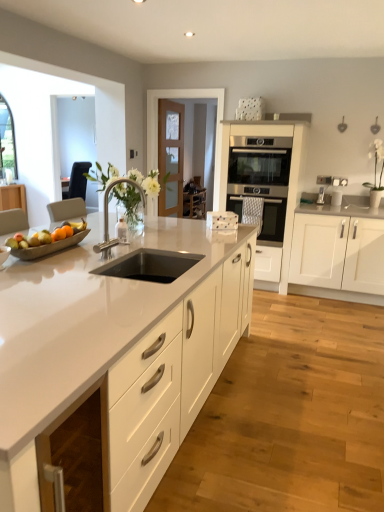
In order to click on free space behind polished chrome faucet at center in this screenshot , I will do `click(115, 250)`.